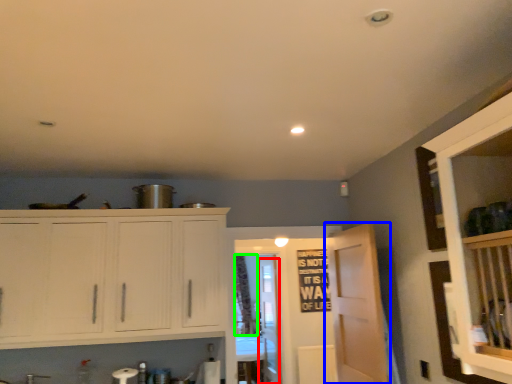
Question: Which object is positioned farthest from glass door (highlighted by a red box)? Select from door (highlighted by a blue box) and curtain (highlighted by a green box).

Choices:
 (A) door
 (B) curtain

Answer: (A)